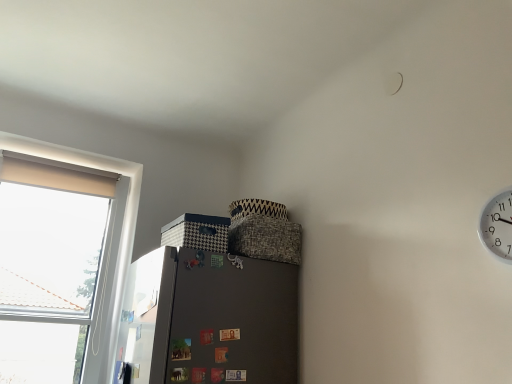
Question: From the image's perspective, is white plastic clock at upper right on top of white fabric window at left?

Choices:
 (A) yes
 (B) no

Answer: (A)

Question: Considering the relative sizes of white plastic clock at upper right and white fabric window at left in the image provided, is white plastic clock at upper right taller than white fabric window at left?

Choices:
 (A) yes
 (B) no

Answer: (B)

Question: Is white plastic clock at upper right facing towards white fabric window at left?

Choices:
 (A) no
 (B) yes

Answer: (A)

Question: Is white plastic clock at upper right to the right of white fabric window at left from the viewer's perspective?

Choices:
 (A) no
 (B) yes

Answer: (B)

Question: Considering the relative sizes of white plastic clock at upper right and white fabric window at left in the image provided, is white plastic clock at upper right wider than white fabric window at left?

Choices:
 (A) yes
 (B) no

Answer: (B)

Question: Is white plastic clock at upper right in contact with white fabric window at left?

Choices:
 (A) yes
 (B) no

Answer: (B)

Question: Is metallic silver screen door at left positioned with its back to white fabric window at left?

Choices:
 (A) no
 (B) yes

Answer: (A)

Question: From a real-world perspective, is metallic silver screen door at left physically above white fabric window at left?

Choices:
 (A) no
 (B) yes

Answer: (A)

Question: Does metallic silver screen door at left have a smaller size compared to white fabric window at left?

Choices:
 (A) no
 (B) yes

Answer: (B)

Question: Does metallic silver screen door at left turn towards white fabric window at left?

Choices:
 (A) no
 (B) yes

Answer: (A)

Question: From a real-world perspective, is metallic silver screen door at left physically below white fabric window at left?

Choices:
 (A) yes
 (B) no

Answer: (A)

Question: Considering the relative sizes of metallic silver screen door at left and white fabric window at left in the image provided, is metallic silver screen door at left bigger than white fabric window at left?

Choices:
 (A) yes
 (B) no

Answer: (B)

Question: Is white fabric window at left behind metallic silver screen door at left?

Choices:
 (A) no
 (B) yes

Answer: (B)